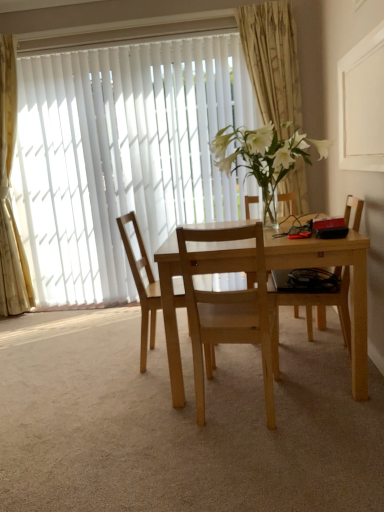
Image resolution: width=384 pixels, height=512 pixels. Find the location of `free space in front of light wood table at center`. free space in front of light wood table at center is located at coordinates (254, 455).